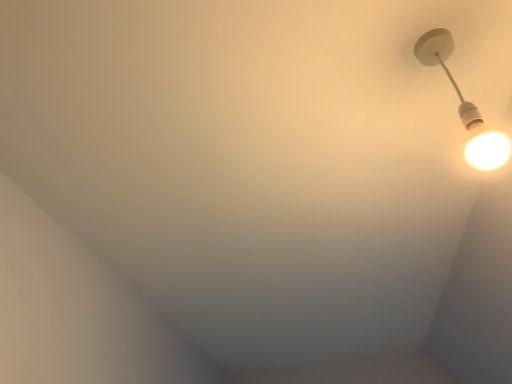
Measure the distance between point (480,150) and camera.

Point (480,150) is 29.69 inches from camera.

What do you see at coordinates (464, 106) in the screenshot? I see `white glossy light bulb at upper right` at bounding box center [464, 106].

You are a GUI agent. You are given a task and a screenshot of the screen. Output one action in this format:
    pyautogui.click(x=<x>, y=<y>)
    Task: Click on the white glossy light bulb at upper right
    Image resolution: width=512 pixels, height=384 pixels.
    Given the screenshot: What is the action you would take?
    pyautogui.click(x=464, y=106)

This screenshot has height=384, width=512. I want to click on white glossy light bulb at upper right, so click(x=464, y=106).